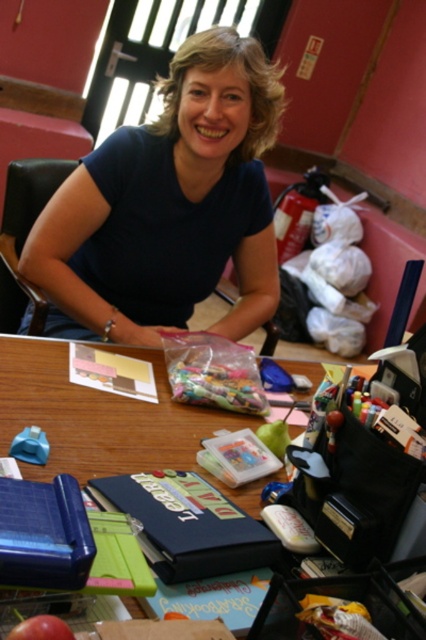
Question: Which object is closer to the camera taking this photo?

Choices:
 (A) blue matte shirt at center
 (B) wooden table at center

Answer: (B)

Question: Is blue matte shirt at center smaller than wooden table at center?

Choices:
 (A) no
 (B) yes

Answer: (A)

Question: Where is blue matte shirt at center located in relation to wooden table at center in the image?

Choices:
 (A) above
 (B) below

Answer: (A)

Question: Is blue matte shirt at center to the left of wooden table at center from the viewer's perspective?

Choices:
 (A) yes
 (B) no

Answer: (B)